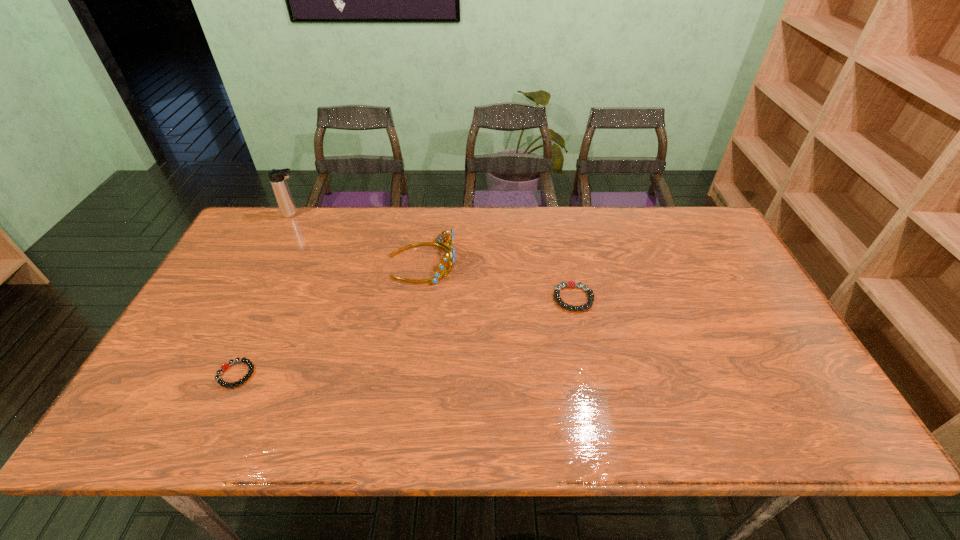
I want to click on free space between the second tallest object and the left bracelet, so click(329, 318).

At what (x,y) coordinates should I click in order to perform the action: click on free point between the nearer bracelet and the thermos bottle. Please return your answer as a coordinate pair (x, y). The width and height of the screenshot is (960, 540). Looking at the image, I should click on (265, 294).

Locate which object is the third closest to the thermos bottle. Please provide its 2D coordinates. Your answer should be formatted as a tuple, i.e. [(x, y)], where the tuple contains the x and y coordinates of a point satisfying the conditions above.

[(571, 284)]

Where is `object that is the second nearest to the second object from right to left`? Image resolution: width=960 pixels, height=540 pixels. object that is the second nearest to the second object from right to left is located at coordinates (277, 177).

Locate an element on the screen. Image resolution: width=960 pixels, height=540 pixels. free location that satisfies the following two spatial constraints: 1. on the handle side of the rightmost object; 2. on the right side of the farthest object is located at coordinates (251, 298).

This screenshot has width=960, height=540. What are the coordinates of `free space that satisfies the following two spatial constraints: 1. on the back side of the taller bracelet; 2. on the handle side of the farthest object` in the screenshot? It's located at (556, 214).

The image size is (960, 540). What are the coordinates of `free location that satisfies the following two spatial constraints: 1. on the back side of the left bracelet; 2. on the right side of the right bracelet` in the screenshot? It's located at (272, 298).

Identify the location of free region that satisfies the following two spatial constraints: 1. on the back side of the shorter bracelet; 2. on the left side of the second shortest object. (272, 298).

This screenshot has height=540, width=960. I want to click on vacant space that satisfies the following two spatial constraints: 1. on the front-facing side of the third shortest object; 2. on the right side of the rightmost object, so click(x=417, y=298).

Identify the location of vacant region that satisfies the following two spatial constraints: 1. on the front-facing side of the second tallest object; 2. on the back side of the farther bracelet. (417, 298).